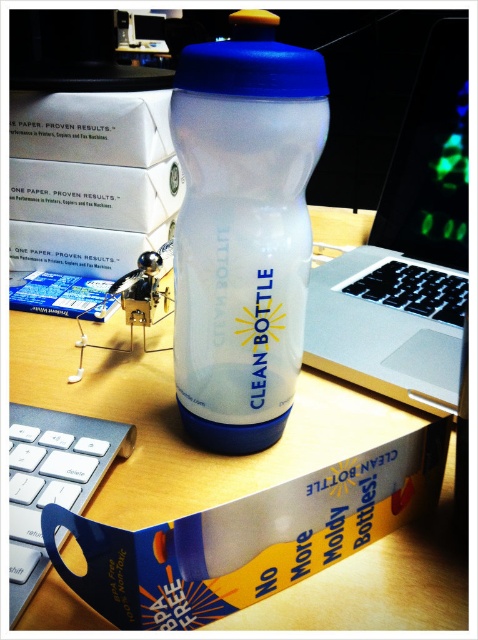
You are organizing your desk and want to place the transparent plastic bottle at center and the sleek silver laptop at center closer together. What is the minimum distance you need to move them to make them touch each other?

The transparent plastic bottle at center and the sleek silver laptop at center are currently 10.30 inches apart. To make them touch, you need to move them a total of 10.30 inches combined. Since you can move both objects, the minimum distance each needs to move would be half of that, so 5.15 inches each.

You are trying to determine the best path to place a new item on the desk without moving the existing objects. You notice two points on the desk labeled as point (201, 412) and point (426, 102). Based on their positions, which point is closer to you and thus safer to place the item?

Point (201, 412) is closer to the viewer than point (426, 102), so placing the item there would be safer as it is nearer to your current position.

You are organizing items on a desk and need to place a new item at the point labeled as point (242, 228). What object is located at that coordinate?

The point (242, 228) corresponds to the transparent plastic bottle at center.